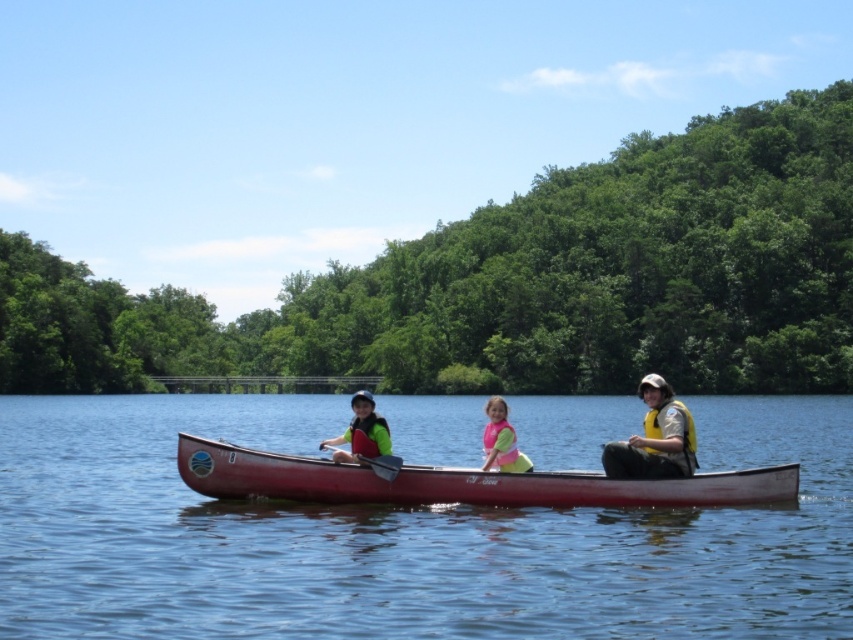
Question: Estimate the real-world distances between objects in this image. Which object is farther from the matte green life vest at center?

Choices:
 (A) yellow life vest at right
 (B) matte black paddle at center
 (C) smooth red canoe at center
 (D) pink life vest at center

Answer: (A)

Question: Can you confirm if yellow life vest at right is smaller than matte black paddle at center?

Choices:
 (A) yes
 (B) no

Answer: (B)

Question: Is smooth blue water at center to the right of smooth red canoe at center from the viewer's perspective?

Choices:
 (A) yes
 (B) no

Answer: (A)

Question: Which point is farther to the camera?

Choices:
 (A) smooth red canoe at center
 (B) matte black paddle at center
 (C) pink life vest at center

Answer: (C)

Question: Which is nearer to the yellow life vest at right?

Choices:
 (A) matte black paddle at center
 (B) matte green life vest at center
 (C) smooth red canoe at center
 (D) pink life vest at center

Answer: (C)

Question: Does matte green life vest at center appear on the left side of pink life vest at center?

Choices:
 (A) no
 (B) yes

Answer: (B)